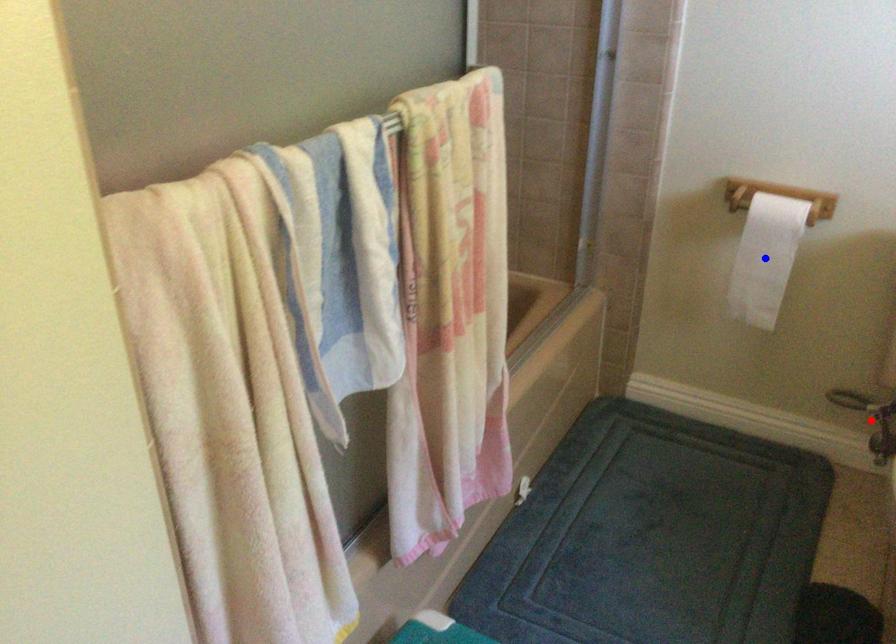
Question: Which of the two points in the image is closer to the camera?

Choices:
 (A) Blue point is closer.
 (B) Red point is closer.

Answer: (A)